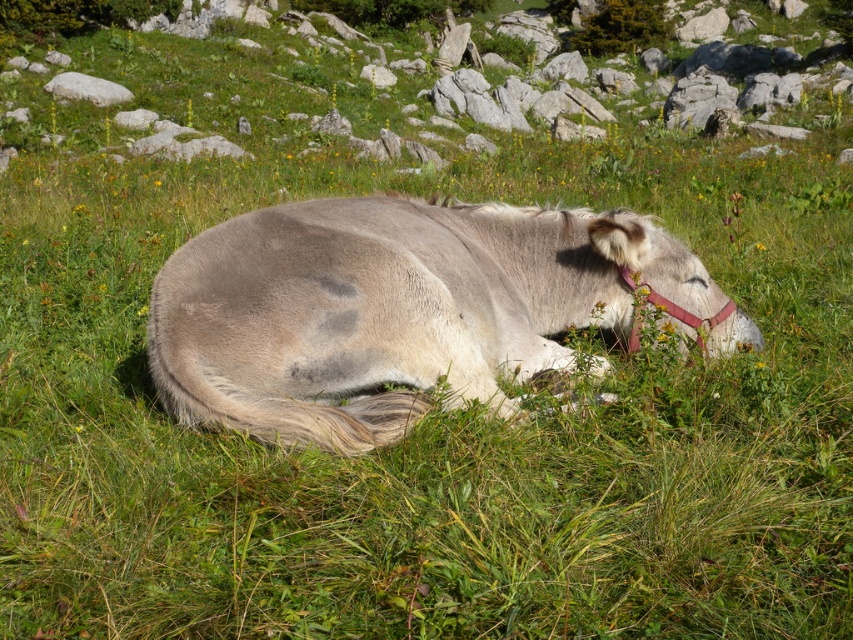
Question: Which of the following is the farthest from the observer?

Choices:
 (A) (325, 253)
 (B) (724, 92)

Answer: (B)

Question: Is green grassy hillside at upper center bigger than white smooth rock at upper left?

Choices:
 (A) no
 (B) yes

Answer: (B)

Question: Can you confirm if green grassy hillside at upper center is wider than white smooth rock at upper left?

Choices:
 (A) no
 (B) yes

Answer: (B)

Question: Can you confirm if gray soft fur donkey at center is wider than white smooth rock at upper left?

Choices:
 (A) no
 (B) yes

Answer: (B)

Question: Which point is closer to the camera?

Choices:
 (A) (0, 166)
 (B) (279, 419)
 (C) (78, 80)

Answer: (B)

Question: Which object is closer to the camera taking this photo?

Choices:
 (A) gray soft fur donkey at center
 (B) white smooth rock at upper left
 (C) green grassy hillside at upper center

Answer: (A)